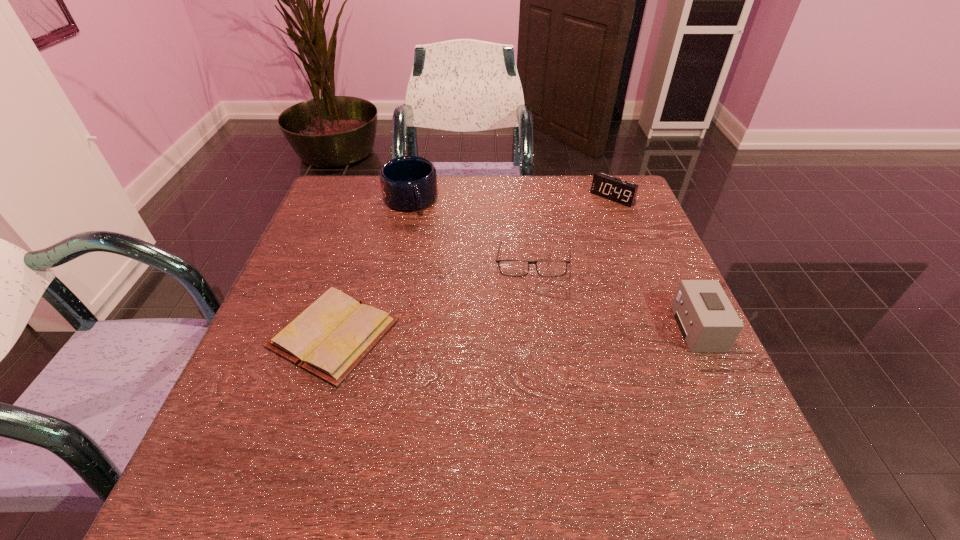
Image resolution: width=960 pixels, height=540 pixels. Identify the location of vacant region between the diary and the mug. coord(372,267).

The width and height of the screenshot is (960, 540). What are the coordinates of `empty location between the third object from left to right and the farther alarm clock` in the screenshot? It's located at (572, 231).

Locate an element on the screen. The width and height of the screenshot is (960, 540). free area in between the shortest object and the nearer alarm clock is located at coordinates (516, 331).

In order to click on free point between the diary and the taller alarm clock in this screenshot , I will do `click(516, 331)`.

This screenshot has width=960, height=540. I want to click on blank region between the taller alarm clock and the farther alarm clock, so click(x=655, y=263).

Locate an element on the screen. object that is the closest to the shorter alarm clock is located at coordinates (517, 268).

Identify the location of object that is the third closest one to the spectacles. The height and width of the screenshot is (540, 960). (329, 338).

The height and width of the screenshot is (540, 960). Find the location of `vacant space that satisfies the following two spatial constraints: 1. on the front side of the nearer alarm clock; 2. on the front-facing side of the shorter alarm clock`. vacant space that satisfies the following two spatial constraints: 1. on the front side of the nearer alarm clock; 2. on the front-facing side of the shorter alarm clock is located at coordinates (664, 328).

In order to click on free region that satisfies the following two spatial constraints: 1. on the front side of the taller alarm clock; 2. on the front-facing side of the mug in this screenshot , I will do `click(384, 328)`.